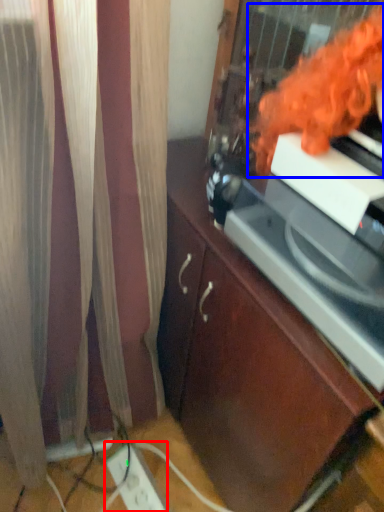
Question: Among these objects, which one is farthest to the camera, extension cord (highlighted by a red box) or woman (highlighted by a blue box)?

Choices:
 (A) extension cord
 (B) woman

Answer: (A)